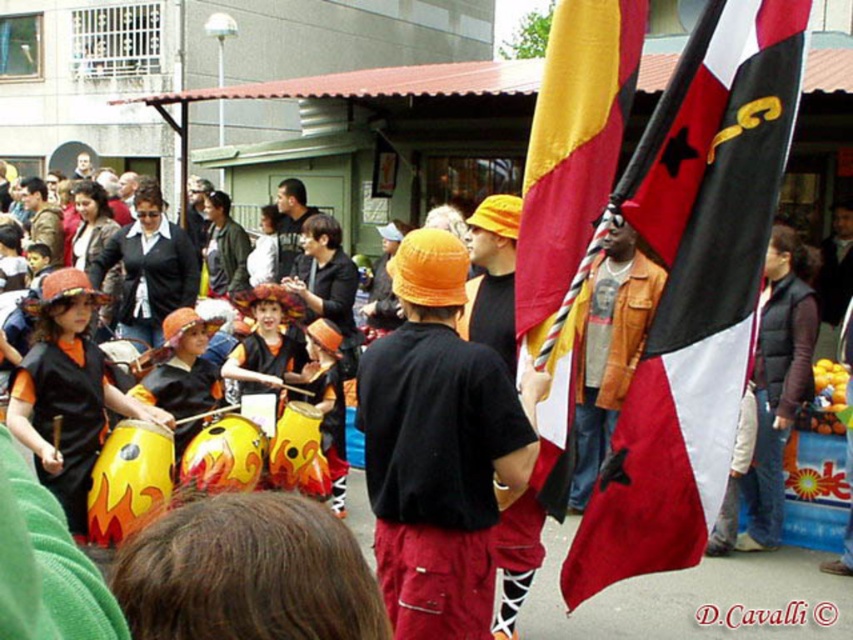
Is orange matte drum at left further to camera compared to orange fabric hat at center?

No.

Between orange matte drum at left and orange fabric hat at center, which one appears on the left side from the viewer's perspective?

From the viewer's perspective, orange matte drum at left appears more on the left side.

The height and width of the screenshot is (640, 853). I want to click on orange matte drum at left, so click(68, 394).

Between yellow fabric flag at center and brown quilted vest at right, which one is positioned higher?

Positioned higher is yellow fabric flag at center.

Does yellow fabric flag at center have a lesser width compared to brown quilted vest at right?

Yes, yellow fabric flag at center is thinner than brown quilted vest at right.

Who is more distant from viewer, (590, 48) or (785, 435)?

Point (785, 435)

Identify the location of yellow fabric flag at center. (572, 150).

Is red fabric flag at right smaller than brown leather jacket at center?

Incorrect, red fabric flag at right is not smaller in size than brown leather jacket at center.

What do you see at coordinates (693, 289) in the screenshot? I see `red fabric flag at right` at bounding box center [693, 289].

Which is in front, point (693, 355) or point (619, 364)?

Point (693, 355)

Where is `red fabric flag at right`? The height and width of the screenshot is (640, 853). red fabric flag at right is located at coordinates click(693, 289).